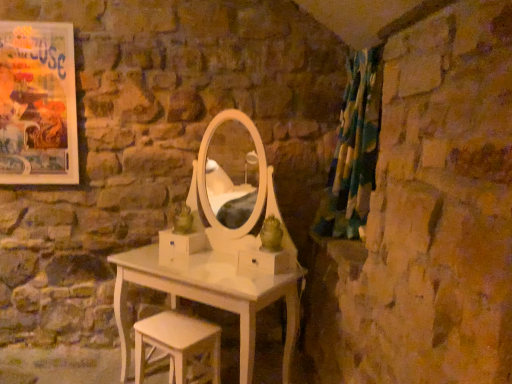
Question: From the image's perspective, is matte paper poster at upper left under multicolored fabric curtain at right?

Choices:
 (A) no
 (B) yes

Answer: (A)

Question: Considering the relative positions of matte paper poster at upper left and multicolored fabric curtain at right in the image provided, is matte paper poster at upper left in front of multicolored fabric curtain at right?

Choices:
 (A) no
 (B) yes

Answer: (A)

Question: Is matte paper poster at upper left oriented away from multicolored fabric curtain at right?

Choices:
 (A) yes
 (B) no

Answer: (B)

Question: Considering the relative sizes of matte paper poster at upper left and multicolored fabric curtain at right in the image provided, is matte paper poster at upper left bigger than multicolored fabric curtain at right?

Choices:
 (A) no
 (B) yes

Answer: (A)

Question: From the image's perspective, is matte paper poster at upper left on multicolored fabric curtain at right?

Choices:
 (A) yes
 (B) no

Answer: (A)

Question: Looking at the image, does matte paper poster at upper left seem bigger or smaller compared to white wood stool at lower center?

Choices:
 (A) big
 (B) small

Answer: (B)

Question: Considering the relative positions of matte paper poster at upper left and white wood stool at lower center in the image provided, is matte paper poster at upper left to the left or to the right of white wood stool at lower center?

Choices:
 (A) right
 (B) left

Answer: (B)

Question: From the image's perspective, is matte paper poster at upper left above or below white wood stool at lower center?

Choices:
 (A) above
 (B) below

Answer: (A)

Question: Looking at their shapes, would you say matte paper poster at upper left is wider or thinner than white wood stool at lower center?

Choices:
 (A) thin
 (B) wide

Answer: (A)

Question: Considering their positions, is matte paper poster at upper left located in front of or behind multicolored fabric curtain at right?

Choices:
 (A) behind
 (B) front

Answer: (A)

Question: Based on their positions, is matte paper poster at upper left located to the left or right of multicolored fabric curtain at right?

Choices:
 (A) left
 (B) right

Answer: (A)

Question: In terms of height, does matte paper poster at upper left look taller or shorter compared to multicolored fabric curtain at right?

Choices:
 (A) short
 (B) tall

Answer: (A)

Question: From the image's perspective, is matte paper poster at upper left positioned above or below multicolored fabric curtain at right?

Choices:
 (A) above
 (B) below

Answer: (A)

Question: Does point (169, 311) appear closer or farther from the camera than point (16, 115)?

Choices:
 (A) farther
 (B) closer

Answer: (A)

Question: From a real-world perspective, is white wood stool at lower center positioned above or below matte paper poster at upper left?

Choices:
 (A) below
 (B) above

Answer: (A)